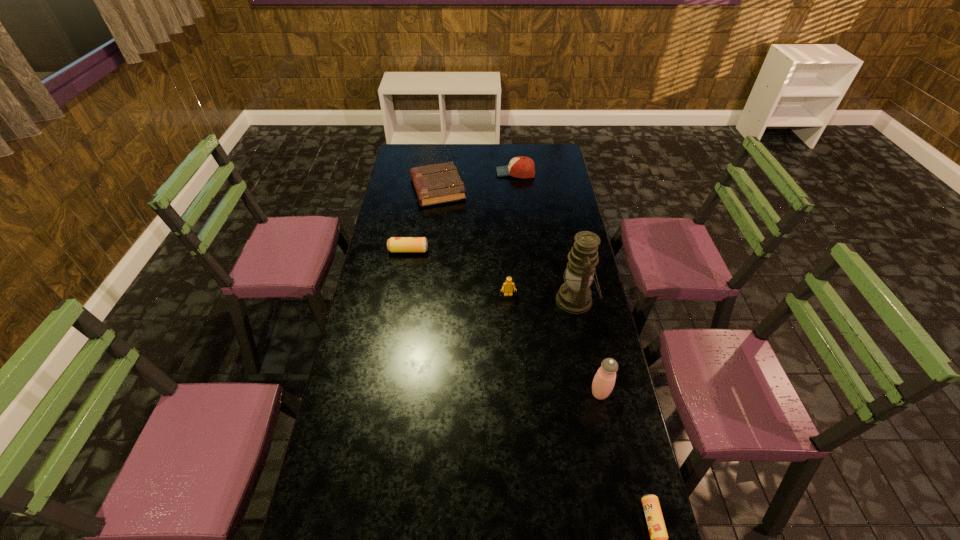
This screenshot has height=540, width=960. Identify the location of vacant area between the left beer can and the sixth shortest object. (504, 322).

At what (x,y) coordinates should I click in order to perform the action: click on vacant area between the taller beer can and the Lego. Please return your answer as a coordinate pair (x, y). Image resolution: width=960 pixels, height=540 pixels. Looking at the image, I should click on (458, 273).

Locate an element on the screen. empty location between the Lego and the second nearest object is located at coordinates (554, 344).

In order to click on free space between the baseball cap and the oil lamp in this screenshot , I will do `click(546, 237)`.

Find the location of `free spot between the hardback book and the thermos bottle`. free spot between the hardback book and the thermos bottle is located at coordinates (518, 291).

Find the location of `vacant point located between the baseball cap and the hardback book`. vacant point located between the baseball cap and the hardback book is located at coordinates (477, 180).

At what (x,y) coordinates should I click in order to perform the action: click on free space between the tallest object and the Lego. Please return your answer as a coordinate pair (x, y). The height and width of the screenshot is (540, 960). Looking at the image, I should click on (542, 298).

Point out which object is positioned as the fifth nearest to the Lego. Please provide its 2D coordinates. Your answer should be formatted as a tuple, i.e. [(x, y)], where the tuple contains the x and y coordinates of a point satisfying the conditions above.

[(520, 167)]

The image size is (960, 540). Identify the location of the fourth closest object to the second tallest object. (395, 244).

The width and height of the screenshot is (960, 540). I want to click on vacant area that satisfies the following two spatial constraints: 1. on the front-facing side of the baseball cap; 2. on the right side of the sixth shortest object, so click(x=538, y=394).